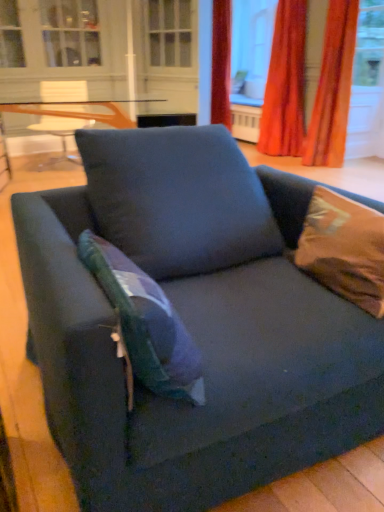
This screenshot has width=384, height=512. What do you see at coordinates (285, 84) in the screenshot?
I see `velvet orange curtain at upper right, which appears as the 1th curtain when viewed from the left` at bounding box center [285, 84].

Find the location of a particular element. This screenshot has width=384, height=512. teal fabric pillow at center, which is the 2th pillow in right-to-left order is located at coordinates (145, 323).

The height and width of the screenshot is (512, 384). What do you see at coordinates (251, 48) in the screenshot? I see `transparent glass window screen at upper center` at bounding box center [251, 48].

The image size is (384, 512). Find the location of `dark blue fabric couch at center`. dark blue fabric couch at center is located at coordinates (192, 325).

Where is `brown satin pillow at upper right, which is the 2th pillow in left-to-right order`? The height and width of the screenshot is (512, 384). brown satin pillow at upper right, which is the 2th pillow in left-to-right order is located at coordinates (344, 249).

The height and width of the screenshot is (512, 384). What are the coordinates of `velvet orange curtain at upper right, marked as the 2th curtain in a left-to-right arrangement` in the screenshot? It's located at (333, 88).

Image resolution: width=384 pixels, height=512 pixels. I want to click on velvet orange curtain at upper right, which appears as the 2th curtain when viewed from the right, so click(x=285, y=84).

Is matte blue armchair at center smaller than brown satin pillow at upper right, marked as the 1th pillow in a right-to-left arrangement?

No, matte blue armchair at center is not smaller than brown satin pillow at upper right, marked as the 1th pillow in a right-to-left arrangement.

Which object is closer to the camera taking this photo, matte blue armchair at center or brown satin pillow at upper right, marked as the 1th pillow in a right-to-left arrangement?

brown satin pillow at upper right, marked as the 1th pillow in a right-to-left arrangement, is in front.

From a real-world perspective, is matte blue armchair at center above or below brown satin pillow at upper right, marked as the 1th pillow in a right-to-left arrangement?

matte blue armchair at center is situated lower than brown satin pillow at upper right, marked as the 1th pillow in a right-to-left arrangement, in the real world.

Is dark blue fabric couch at center far away from transparent glass window screen at upper center?

That's right, there is a large distance between dark blue fabric couch at center and transparent glass window screen at upper center.

Is point (180, 430) behind point (261, 51)?

No.

From a real-world perspective, is dark blue fabric couch at center located higher than transparent glass window screen at upper center?

No.

Does dark blue fabric couch at center have a greater height compared to transparent glass window screen at upper center?

No.

Consider the image. Considering the sizes of objects matte blue armchair at center and white glass screen door at upper center in the image provided, who is shorter, matte blue armchair at center or white glass screen door at upper center?

With less height is matte blue armchair at center.

Does point (61, 141) come farther from viewer compared to point (162, 75)?

No, it is in front of (162, 75).

From the image's perspective, is matte blue armchair at center positioned above or below white glass screen door at upper center?

Clearly, from the image's perspective, matte blue armchair at center is below white glass screen door at upper center.

Based on their positions, is matte blue armchair at center located to the left or right of white glass screen door at upper center?

matte blue armchair at center is positioned on white glass screen door at upper center's left side.

Considering the positions of points (114, 308) and (191, 426), is point (114, 308) farther from camera compared to point (191, 426)?

No, (114, 308) is closer to viewer.

Considering the relative positions of teal fabric pillow at center, positioned as the first pillow in left-to-right order, and dark blue fabric couch at center in the image provided, is teal fabric pillow at center, positioned as the first pillow in left-to-right order, to the left of dark blue fabric couch at center from the viewer's perspective?

Yes, teal fabric pillow at center, positioned as the first pillow in left-to-right order, is to the left of dark blue fabric couch at center.

Choose the correct answer: Is teal fabric pillow at center, positioned as the first pillow in left-to-right order, inside dark blue fabric couch at center or outside it?

teal fabric pillow at center, positioned as the first pillow in left-to-right order, is contained in dark blue fabric couch at center.

Are teal fabric pillow at center, which is the 2th pillow in right-to-left order, and dark blue fabric couch at center located far from each other?

No, teal fabric pillow at center, which is the 2th pillow in right-to-left order, is in close proximity to dark blue fabric couch at center.

Which object is positioned more to the left, velvet orange curtain at upper right, which appears as the 2th curtain when viewed from the right, or white glass screen door at upper center?

white glass screen door at upper center.

Which is behind, point (289, 34) or point (176, 66)?

Point (176, 66)

Locate an element on the screen. This screenshot has height=512, width=384. screen door to the left of velvet orange curtain at upper right, which appears as the 1th curtain when viewed from the left is located at coordinates (168, 56).

From the image's perspective, between velvet orange curtain at upper right, which appears as the 2th curtain when viewed from the right, and white glass screen door at upper center, which one is located above?

white glass screen door at upper center is shown above in the image.

In the scene shown: In the image, is teal fabric pillow at center, which is the 2th pillow in right-to-left order, on the left side or the right side of clear glass table at upper center?

teal fabric pillow at center, which is the 2th pillow in right-to-left order, is to the right of clear glass table at upper center.

This screenshot has height=512, width=384. Identify the location of the 2nd pillow in front of the clear glass table at upper center. (145, 323).

From a real-world perspective, is teal fabric pillow at center, positioned as the first pillow in left-to-right order, beneath clear glass table at upper center?

No, from a real-world perspective, teal fabric pillow at center, positioned as the first pillow in left-to-right order, is not under clear glass table at upper center.

Which is behind, teal fabric pillow at center, which is the 2th pillow in right-to-left order, or clear glass table at upper center?

clear glass table at upper center is further from the camera.

Considering the sizes of objects velvet orange curtain at upper right, which appears as the 1th curtain when viewed from the left, and velvet orange curtain at upper right, marked as the 2th curtain in a left-to-right arrangement, in the image provided, who is thinner, velvet orange curtain at upper right, which appears as the 1th curtain when viewed from the left, or velvet orange curtain at upper right, marked as the 2th curtain in a left-to-right arrangement,?

Thinner between the two is velvet orange curtain at upper right, marked as the 2th curtain in a left-to-right arrangement.

Is velvet orange curtain at upper right, which appears as the 2th curtain when viewed from the right, not within velvet orange curtain at upper right, the first curtain from the right?

Yes.

Locate an element on the screen. The image size is (384, 512). curtain behind the velvet orange curtain at upper right, marked as the 2th curtain in a left-to-right arrangement is located at coordinates (285, 84).

Between velvet orange curtain at upper right, which appears as the 1th curtain when viewed from the left, and velvet orange curtain at upper right, marked as the 2th curtain in a left-to-right arrangement, which one is positioned in front?

Positioned in front is velvet orange curtain at upper right, marked as the 2th curtain in a left-to-right arrangement.

Locate an element on the screen. The image size is (384, 512). armchair behind the brown satin pillow at upper right, marked as the 1th pillow in a right-to-left arrangement is located at coordinates (62, 114).

This screenshot has height=512, width=384. I want to click on studio couch on the left of transparent glass window screen at upper center, so click(x=192, y=325).

From the image, which object appears to be farther from white glass screen door at upper center, velvet orange curtain at upper right, which appears as the 2th curtain when viewed from the right, or matte blue armchair at center?

Based on the image, matte blue armchair at center appears to be further to white glass screen door at upper center.

From the image, which object appears to be nearer to dark blue fabric couch at center, matte blue armchair at center or white glass screen door at upper center?

matte blue armchair at center.

Based on their spatial positions, is matte blue armchair at center or white glass screen door at upper center further from velvet orange curtain at upper right, marked as the 2th curtain in a left-to-right arrangement?

Based on the image, matte blue armchair at center appears to be further to velvet orange curtain at upper right, marked as the 2th curtain in a left-to-right arrangement.

Which object lies nearer to the anchor point brown satin pillow at upper right, which is the 2th pillow in left-to-right order, matte blue armchair at center or velvet orange curtain at upper right, the first curtain from the right?

matte blue armchair at center is positioned closer to the anchor brown satin pillow at upper right, which is the 2th pillow in left-to-right order.

Considering their positions, is brown satin pillow at upper right, marked as the 1th pillow in a right-to-left arrangement, positioned further to clear glass table at upper center than teal fabric pillow at center, which is the 2th pillow in right-to-left order?

teal fabric pillow at center, which is the 2th pillow in right-to-left order, is positioned further to the anchor clear glass table at upper center.

Looking at the image, which one is located further to transparent glass window screen at upper center, white glass screen door at upper center or velvet orange curtain at upper right, marked as the 2th curtain in a left-to-right arrangement?

Based on the image, velvet orange curtain at upper right, marked as the 2th curtain in a left-to-right arrangement, appears to be further to transparent glass window screen at upper center.

When comparing their distances from matte blue armchair at center, does velvet orange curtain at upper right, which appears as the 1th curtain when viewed from the left, or transparent glass window screen at upper center seem further?

The object further to matte blue armchair at center is transparent glass window screen at upper center.

Which object lies nearer to the anchor point velvet orange curtain at upper right, the first curtain from the right, matte blue armchair at center or teal fabric pillow at center, positioned as the first pillow in left-to-right order?

matte blue armchair at center is positioned closer to the anchor velvet orange curtain at upper right, the first curtain from the right.

Identify the location of table between brown satin pillow at upper right, marked as the 1th pillow in a right-to-left arrangement, and velvet orange curtain at upper right, which appears as the 1th curtain when viewed from the left, along the z-axis. The image size is (384, 512). (80, 111).

Where is `table between dark blue fabric couch at center and velvet orange curtain at upper right, which appears as the 1th curtain when viewed from the left, along the z-axis`? table between dark blue fabric couch at center and velvet orange curtain at upper right, which appears as the 1th curtain when viewed from the left, along the z-axis is located at coordinates (80, 111).

Where is `curtain between brown satin pillow at upper right, marked as the 1th pillow in a right-to-left arrangement, and velvet orange curtain at upper right, which appears as the 1th curtain when viewed from the left, along the z-axis`? The height and width of the screenshot is (512, 384). curtain between brown satin pillow at upper right, marked as the 1th pillow in a right-to-left arrangement, and velvet orange curtain at upper right, which appears as the 1th curtain when viewed from the left, along the z-axis is located at coordinates (333, 88).

Image resolution: width=384 pixels, height=512 pixels. I want to click on armchair between clear glass table at upper center and transparent glass window screen at upper center along the z-axis, so click(62, 114).